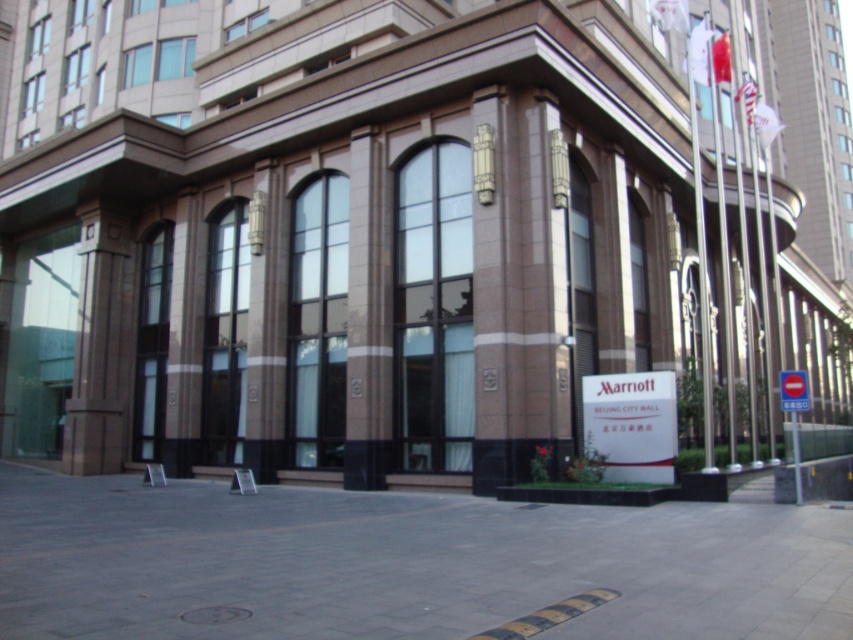
Can you confirm if brown stone column at center is smaller than white plastic sign at center right?

Yes, brown stone column at center is smaller than white plastic sign at center right.

Which is above, brown stone column at center or white plastic sign at center right?

Positioned higher is brown stone column at center.

Which is in front, point (347, 362) or point (808, 397)?

Positioned in front is point (808, 397).

You are a GUI agent. You are given a task and a screenshot of the screen. Output one action in this format:
    pyautogui.click(x=<x>, y=<y>)
    Task: Click on the brown stone column at center
    This screenshot has width=853, height=640.
    Given the screenshot: What is the action you would take?
    pyautogui.click(x=368, y=314)

Who is positioned more to the right, gray concrete pavement at center or brown stone column at center?

From the viewer's perspective, gray concrete pavement at center appears more on the right side.

You are a GUI agent. You are given a task and a screenshot of the screen. Output one action in this format:
    pyautogui.click(x=<x>, y=<y>)
    Task: Click on the gray concrete pavement at center
    This screenshot has width=853, height=640.
    Given the screenshot: What is the action you would take?
    pyautogui.click(x=402, y=563)

Is white paper sign at lower right thinner than white plastic sign at center right?

Correct, white paper sign at lower right's width is less than white plastic sign at center right's.

Which of these two, white paper sign at lower right or white plastic sign at center right, stands shorter?

white plastic sign at center right is shorter.

Who is more forward, (593, 392) or (793, 406)?

→ Point (793, 406) is in front.

This screenshot has height=640, width=853. I want to click on white paper sign at lower right, so click(631, 424).